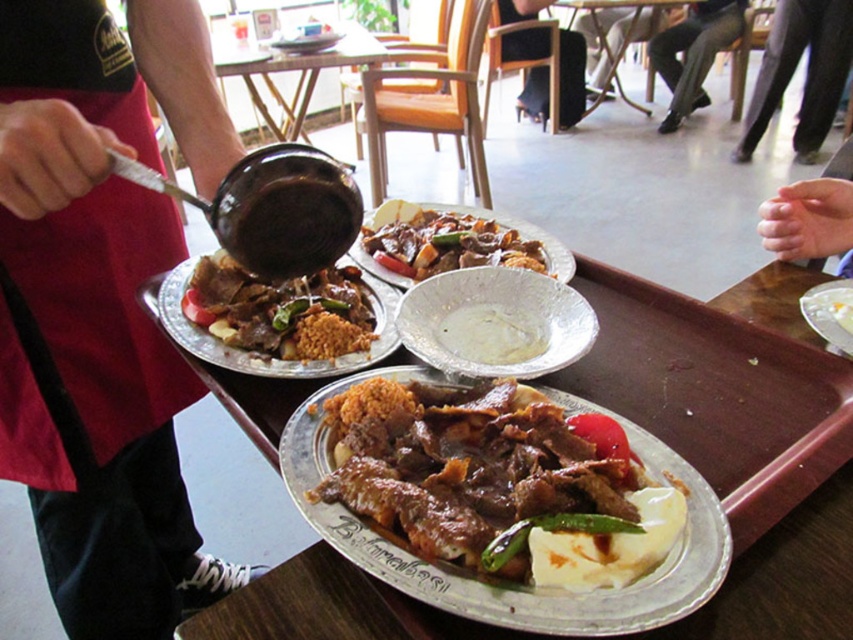
Looking at this image, you are a customer in the dining establishment and want to locate the server wearing the red apron at left. According to the coordinates provided, where would you find them in relation to the tray?

The red apron at left is located at coordinates point (x=102, y=305), which is to the left side of the tray.

You are a customer at the restaurant and want to place your phone on the table next to the black leather pants at lower right and the white glossy plate at lower right. Which object should you place it closer to if you want the phone to be as far as possible from the edge of the table?

The black leather pants at lower right has a greater width than the white glossy plate at lower right, so placing the phone closer to the black leather pants at lower right would keep it farther from the table edge.

You are a customer in the restaurant and you want to know which item is larger between the red apron at left and the brown meaty stew at center. Can you tell me?

The red apron at left is bigger than the brown meaty stew at center.